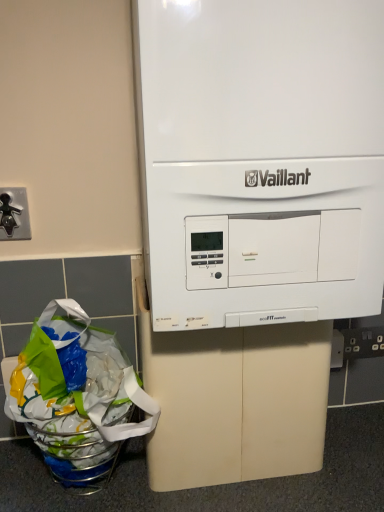
What is the approximate width of white matte vaillant boiler at center?

13.55 inches.

Measure the distance between point (75, 376) and camera.

They are 33.78 inches apart.

Identify the location of black metal faucet at left. (8, 214).

Where is `white matte vaillant boiler at center`? This screenshot has width=384, height=512. white matte vaillant boiler at center is located at coordinates (253, 224).

Based on their sizes in the image, would you say white plastic electric outlet at lower right is bigger or smaller than translucent plastic grocery bag at lower left?

Clearly, white plastic electric outlet at lower right is smaller in size than translucent plastic grocery bag at lower left.

What are the coordinates of `electric outlet to the right of translucent plastic grocery bag at lower left` in the screenshot? It's located at (363, 342).

Looking at this image, which is behind, white plastic electric outlet at lower right or translucent plastic grocery bag at lower left?

white plastic electric outlet at lower right is further from the camera.

Considering the sizes of objects white plastic electric outlet at lower right and translucent plastic grocery bag at lower left in the image provided, who is taller, white plastic electric outlet at lower right or translucent plastic grocery bag at lower left?

With more height is translucent plastic grocery bag at lower left.

Could translucent plastic grocery bag at lower left be considered to be inside black metal faucet at left?

Definitely not — translucent plastic grocery bag at lower left is not inside black metal faucet at left.

In the scene shown: Measure the distance from black metal faucet at left to translucent plastic grocery bag at lower left.

black metal faucet at left and translucent plastic grocery bag at lower left are 14.75 inches apart from each other.

Is translucent plastic grocery bag at lower left at the back of black metal faucet at left?

No, black metal faucet at left is not facing away from translucent plastic grocery bag at lower left.

Between point (5, 228) and point (114, 425), which one is positioned behind?

The point (5, 228) is more distant.

Find the location of `grocery bag that appears above the white plastic electric outlet at lower right (from a real-world perspective)`. grocery bag that appears above the white plastic electric outlet at lower right (from a real-world perspective) is located at coordinates pyautogui.click(x=76, y=394).

Which point is more forward, (62, 311) or (381, 344)?

The point (62, 311) is more forward.

Does translucent plastic grocery bag at lower left appear on the left side of white plastic electric outlet at lower right?

Correct, you'll find translucent plastic grocery bag at lower left to the left of white plastic electric outlet at lower right.

From the image's perspective, is translucent plastic grocery bag at lower left beneath white plastic electric outlet at lower right?

Yes, from the image's perspective, translucent plastic grocery bag at lower left is beneath white plastic electric outlet at lower right.

Could you tell me if white matte vaillant boiler at center is facing translucent plastic grocery bag at lower left?

No, white matte vaillant boiler at center does not turn towards translucent plastic grocery bag at lower left.

Which of these two, white matte vaillant boiler at center or translucent plastic grocery bag at lower left, is thinner?

Thinner between the two is translucent plastic grocery bag at lower left.

Can you confirm if white matte vaillant boiler at center is shorter than translucent plastic grocery bag at lower left?

Incorrect, the height of white matte vaillant boiler at center does not fall short of that of translucent plastic grocery bag at lower left.

From the image's perspective, is translucent plastic grocery bag at lower left on top of black metal faucet at left?

No, from the image's perspective, translucent plastic grocery bag at lower left is not on top of black metal faucet at left.

In terms of height, does translucent plastic grocery bag at lower left look taller or shorter compared to black metal faucet at left?

Clearly, translucent plastic grocery bag at lower left is taller compared to black metal faucet at left.

From a real-world perspective, between translucent plastic grocery bag at lower left and black metal faucet at left, who is vertically lower?

translucent plastic grocery bag at lower left.

Could you tell me if white plastic electric outlet at lower right is turned towards black metal faucet at left?

No, white plastic electric outlet at lower right is not facing towards black metal faucet at left.

What's the angular difference between white plastic electric outlet at lower right and black metal faucet at left's facing directions?

white plastic electric outlet at lower right and black metal faucet at left are facing 0.0161 degrees away from each other.

Does white plastic electric outlet at lower right appear on the right side of black metal faucet at left?

Yes, white plastic electric outlet at lower right is to the right of black metal faucet at left.

From the image's perspective, is white plastic electric outlet at lower right located above or below black metal faucet at left?

white plastic electric outlet at lower right is situated lower than black metal faucet at left in the image.

From their relative heights in the image, would you say black metal faucet at left is taller or shorter than white matte vaillant boiler at center?

Clearly, black metal faucet at left is shorter compared to white matte vaillant boiler at center.

Is black metal faucet at left positioned far away from white matte vaillant boiler at center?

black metal faucet at left is near white matte vaillant boiler at center, not far away.

From a real-world perspective, is black metal faucet at left located higher than white matte vaillant boiler at center?

Incorrect, from a real-world perspective, black metal faucet at left is lower than white matte vaillant boiler at center.

Does black metal faucet at left have a larger size compared to white matte vaillant boiler at center?

Incorrect, black metal faucet at left is not larger than white matte vaillant boiler at center.

Where is `grocery bag that appears in front of the white plastic electric outlet at lower right`? Image resolution: width=384 pixels, height=512 pixels. grocery bag that appears in front of the white plastic electric outlet at lower right is located at coordinates tap(76, 394).

Locate an element on the screen. The image size is (384, 512). grocery bag that is on the right side of black metal faucet at left is located at coordinates (76, 394).

Based on the photo, considering their positions, is white matte vaillant boiler at center positioned further to translucent plastic grocery bag at lower left than white plastic electric outlet at lower right?

white plastic electric outlet at lower right is positioned further to the anchor translucent plastic grocery bag at lower left.

When comparing their distances from translucent plastic grocery bag at lower left, does black metal faucet at left or white matte vaillant boiler at center seem further?

black metal faucet at left lies further to translucent plastic grocery bag at lower left than the other object.

Based on the photo, when comparing their distances from translucent plastic grocery bag at lower left, does white plastic electric outlet at lower right or black metal faucet at left seem closer?

Among the two, black metal faucet at left is located nearer to translucent plastic grocery bag at lower left.

Considering their positions, is white plastic electric outlet at lower right positioned further to black metal faucet at left than translucent plastic grocery bag at lower left?

Among the two, white plastic electric outlet at lower right is located further to black metal faucet at left.

Estimate the real-world distances between objects in this image. Which object is closer to translucent plastic grocery bag at lower left, black metal faucet at left or white plastic electric outlet at lower right?

black metal faucet at left is closer to translucent plastic grocery bag at lower left.

Considering their positions, is translucent plastic grocery bag at lower left positioned closer to white plastic electric outlet at lower right than black metal faucet at left?

translucent plastic grocery bag at lower left.

In the scene shown: Looking at the image, which one is located further to black metal faucet at left, translucent plastic grocery bag at lower left or white plastic electric outlet at lower right?

white plastic electric outlet at lower right.

Considering their positions, is white plastic electric outlet at lower right positioned further to black metal faucet at left than white matte vaillant boiler at center?

The object further to black metal faucet at left is white plastic electric outlet at lower right.

Identify the location of grocery bag between black metal faucet at left and white plastic electric outlet at lower right in the horizontal direction. This screenshot has height=512, width=384. (76, 394).

You are a GUI agent. You are given a task and a screenshot of the screen. Output one action in this format:
    pyautogui.click(x=<x>, y=<y>)
    Task: Click on the home appliance situated between translucent plastic grocery bag at lower left and white plastic electric outlet at lower right from left to right
    The height and width of the screenshot is (512, 384).
    Given the screenshot: What is the action you would take?
    pyautogui.click(x=253, y=224)

Locate an element on the screen. grocery bag situated between black metal faucet at left and white matte vaillant boiler at center from left to right is located at coordinates (76, 394).

Find the location of a particular element. home appliance located between black metal faucet at left and white plastic electric outlet at lower right in the left-right direction is located at coordinates (253, 224).